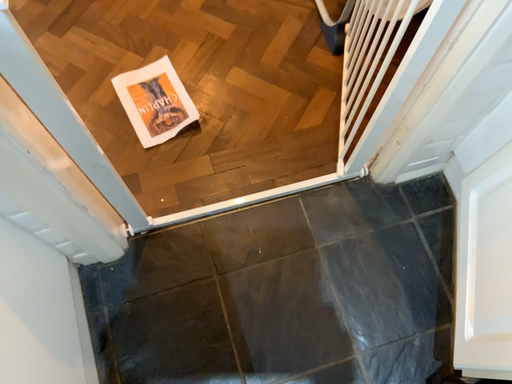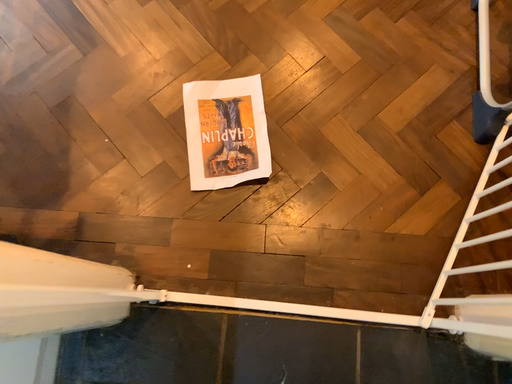
Question: How did the camera likely rotate when shooting the video?

Choices:
 (A) rotated right
 (B) rotated left

Answer: (B)